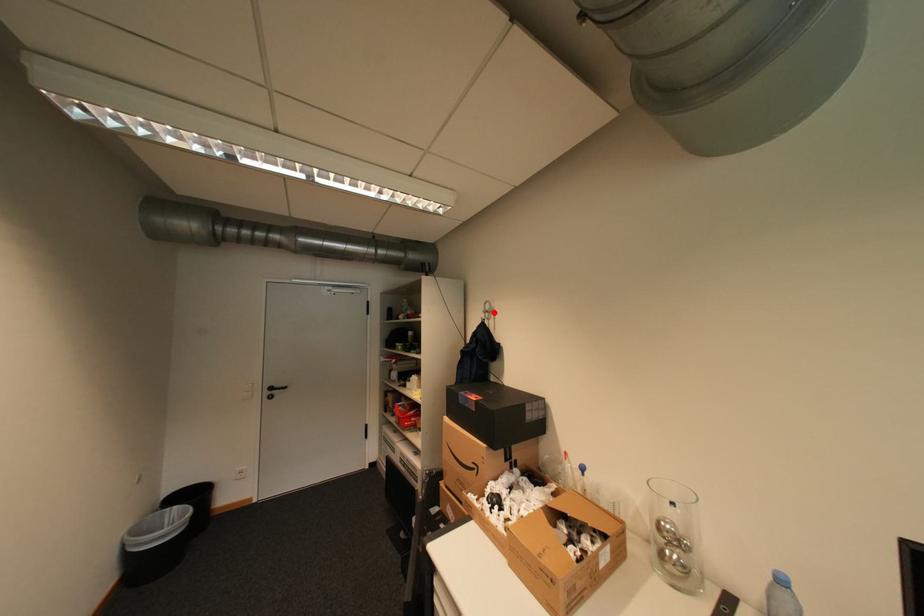
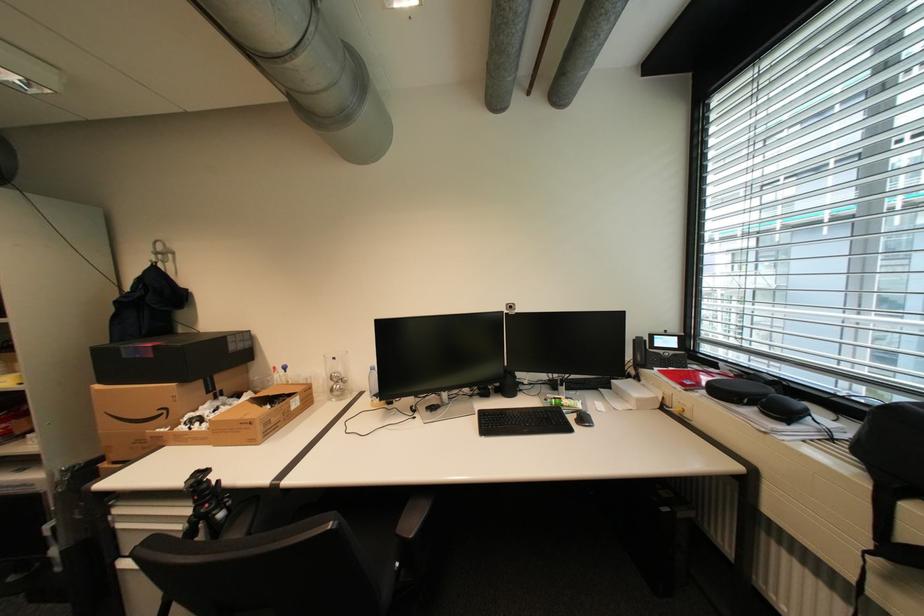
Find the pixel in the second image that matches the highlighted location in the first image.

(165, 254)